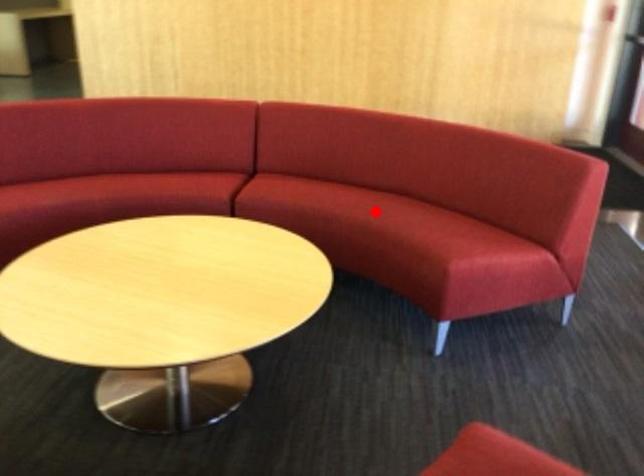
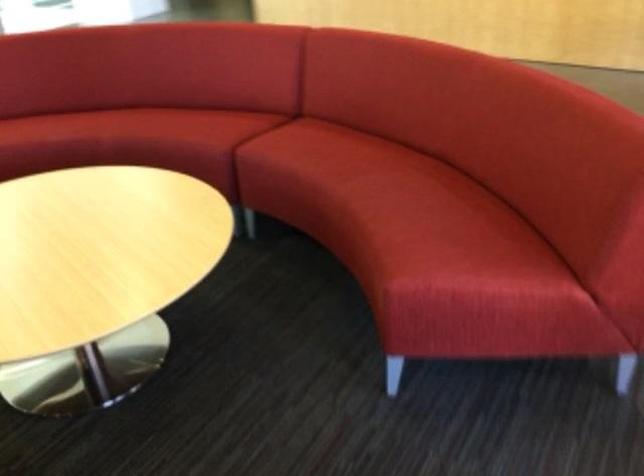
Locate, in the second image, the point that corresponds to the highlighted location in the first image.

(370, 186)